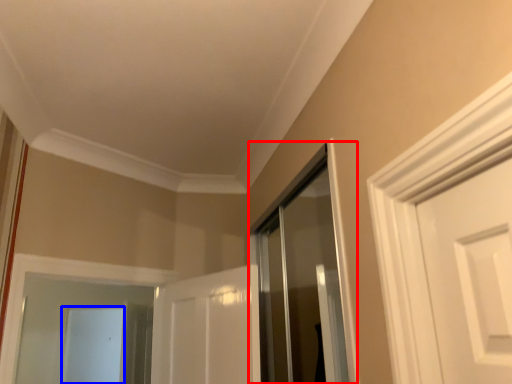
Question: Among these objects, which one is nearest to the camera, shower door (highlighted by a red box) or screen door (highlighted by a blue box)?

Choices:
 (A) shower door
 (B) screen door

Answer: (A)